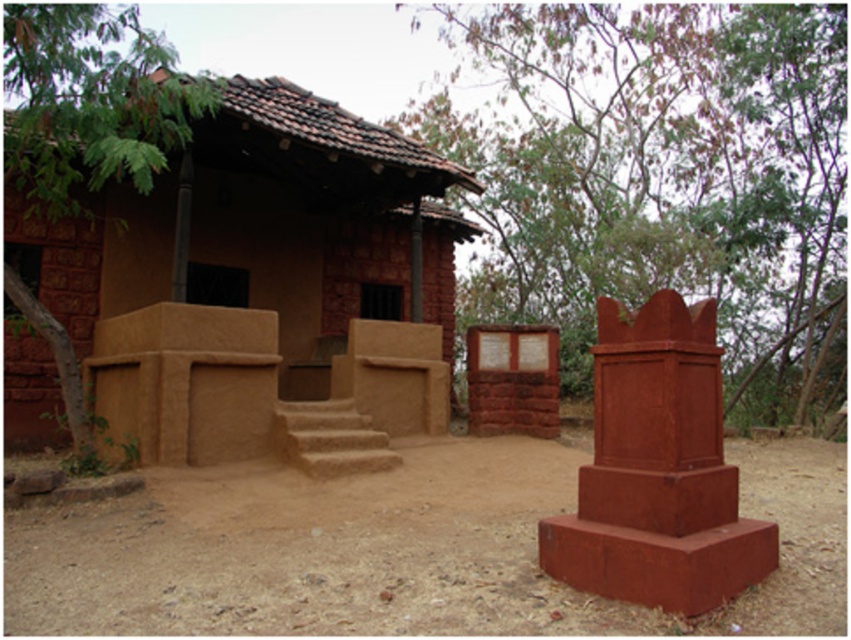
You are standing at the entrance of the rustic building and notice a specific point marked at coordinates (664, 176). Based on the scene description, can you identify what object this point is located on?

The point at (664, 176) is located on the green leafy tree at upper right.